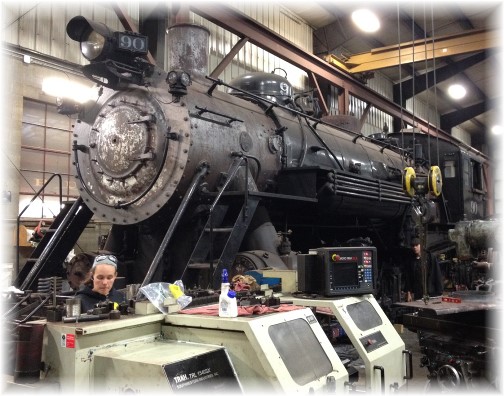
The image size is (504, 396). Find the location of `handle`. handle is located at coordinates (379, 379).